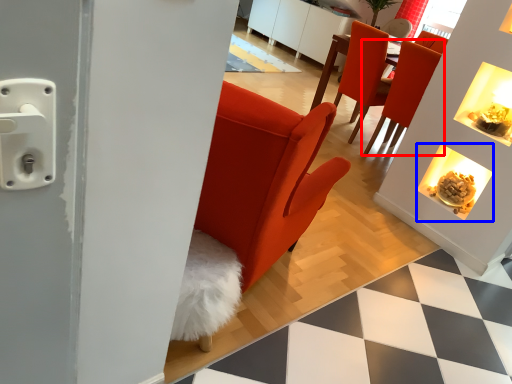
Question: Which object appears closest to the camera in this image, chair (highlighted by a red box) or fireplace (highlighted by a blue box)?

Choices:
 (A) chair
 (B) fireplace

Answer: (B)